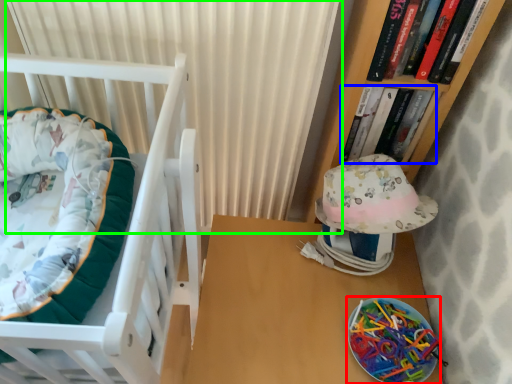
Question: Which object is the farthest from glass plate (highlighted by a red box)? Choose among these: book (highlighted by a blue box) or curtain (highlighted by a green box).

Choices:
 (A) book
 (B) curtain

Answer: (B)